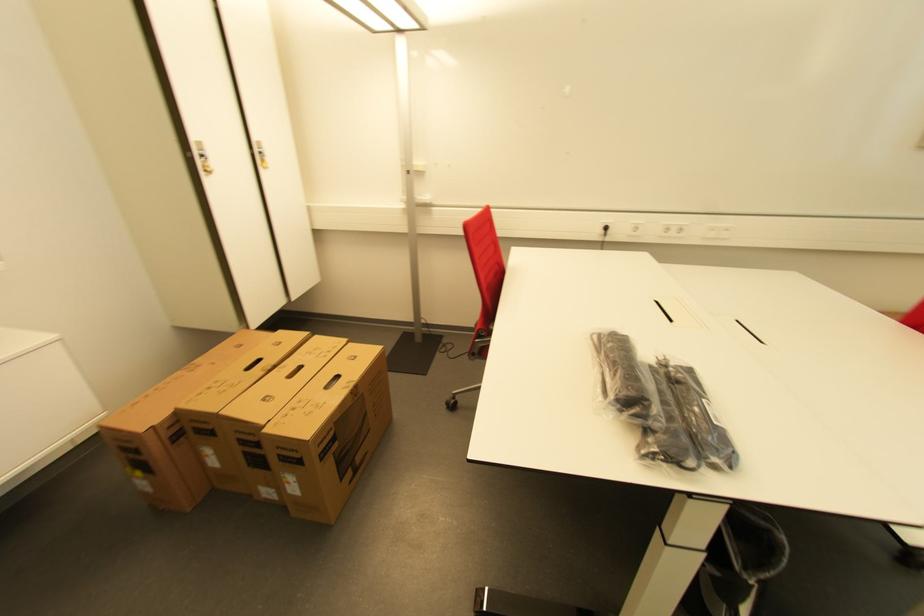
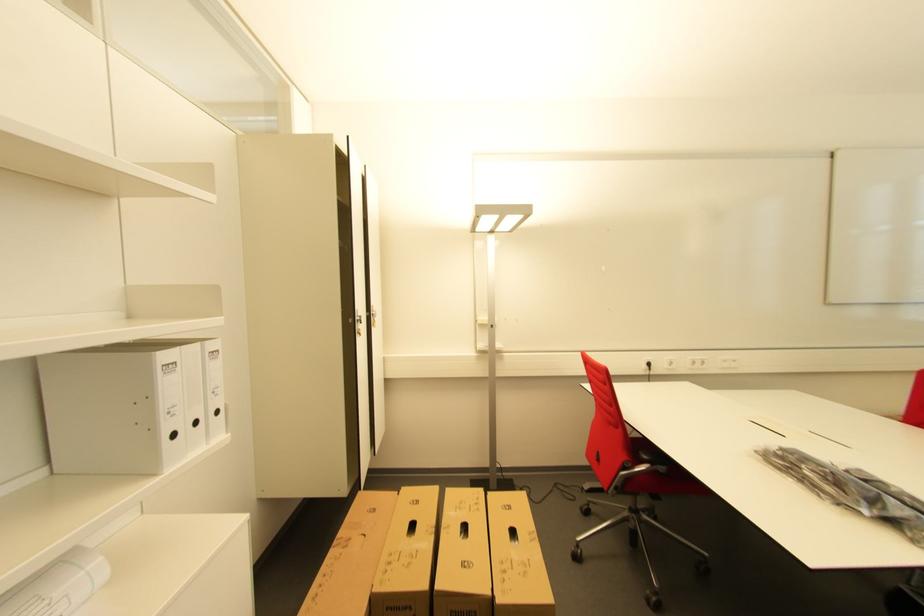
Question: Which direction would the cameraman need to move to produce the second image? Reply with the corresponding letter.

Choices:
 (A) Left
 (B) Right
 (C) Forward
 (D) Backward

Answer: (A)